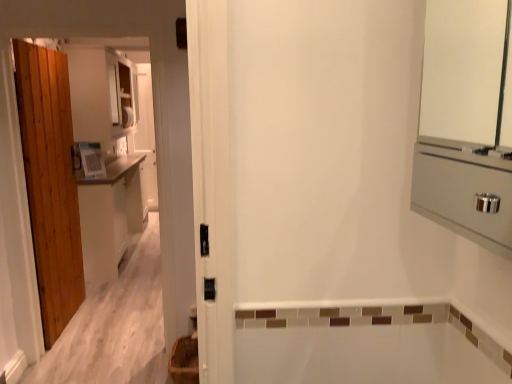
Locate an element on the screen. This screenshot has width=512, height=384. white matte cabinet at left is located at coordinates (111, 215).

In order to face white matte cabinet at left, should I rotate leftwards or rightwards?

Turn left approximately 18.091 degrees to face it.

Describe the element at coordinates (111, 215) in the screenshot. I see `white matte cabinet at left` at that location.

This screenshot has height=384, width=512. Describe the element at coordinates (184, 361) in the screenshot. I see `brown woven basket at lower left` at that location.

This screenshot has width=512, height=384. In order to click on brown woven basket at lower left in this screenshot , I will do `click(184, 361)`.

This screenshot has height=384, width=512. Identify the location of white matte cabinet at left. (111, 215).

Can you confirm if white matte cabinet at left is positioned to the right of brown woven basket at lower left?

No.

Between white matte cabinet at left and brown woven basket at lower left, which one is positioned in front?

brown woven basket at lower left.

Is point (86, 255) closer or farther from the camera than point (182, 340)?

Point (86, 255) is positioned farther from the camera compared to point (182, 340).

From the image's perspective, does white matte cabinet at left appear lower than brown woven basket at lower left?

No, from the image's perspective, white matte cabinet at left is not beneath brown woven basket at lower left.

From a real-world perspective, is white matte cabinet at left physically located above or below brown woven basket at lower left?

In terms of real-world spatial position, white matte cabinet at left is above brown woven basket at lower left.

Between white matte cabinet at left and brown woven basket at lower left, which one has larger width?

Wider between the two is brown woven basket at lower left.

Considering the relative sizes of white matte cabinet at left and brown woven basket at lower left in the image provided, is white matte cabinet at left taller than brown woven basket at lower left?

Indeed, white matte cabinet at left has a greater height compared to brown woven basket at lower left.

Can you confirm if white matte cabinet at left is smaller than brown woven basket at lower left?

No.

Can we say white matte cabinet at left lies outside brown woven basket at lower left?

Yes, white matte cabinet at left is not within brown woven basket at lower left.

Is white matte cabinet at left placed right next to brown woven basket at lower left?

No, white matte cabinet at left is not with brown woven basket at lower left.

Could you tell me if white matte cabinet at left is turned towards brown woven basket at lower left?

No, white matte cabinet at left does not turn towards brown woven basket at lower left.

You are a GUI agent. You are given a task and a screenshot of the screen. Output one action in this format:
    pyautogui.click(x=<x>, y=<y>)
    Task: Click on the cabinetry above the brown woven basket at lower left (from the image's perspective)
    
    Given the screenshot: What is the action you would take?
    pyautogui.click(x=111, y=215)

Does brown woven basket at lower left appear on the left side of white matte cabinet at left?

No, brown woven basket at lower left is not to the left of white matte cabinet at left.

Is brown woven basket at lower left in front of or behind white matte cabinet at left in the image?

Clearly, brown woven basket at lower left is in front of white matte cabinet at left.

Does point (196, 362) appear closer or farther from the camera than point (110, 251)?

Point (196, 362) is closer to the camera than point (110, 251).

From the image's perspective, is brown woven basket at lower left below white matte cabinet at left?

Yes, from the image's perspective, brown woven basket at lower left is beneath white matte cabinet at left.

From a real-world perspective, relative to white matte cabinet at left, is brown woven basket at lower left vertically above or below?

From a real-world perspective, brown woven basket at lower left is physically below white matte cabinet at left.

Is brown woven basket at lower left wider or thinner than white matte cabinet at left?

Clearly, brown woven basket at lower left has more width compared to white matte cabinet at left.

Can you confirm if brown woven basket at lower left is shorter than white matte cabinet at left?

Yes, brown woven basket at lower left is shorter than white matte cabinet at left.

In terms of size, does brown woven basket at lower left appear bigger or smaller than white matte cabinet at left?

Clearly, brown woven basket at lower left is smaller in size than white matte cabinet at left.

Do you think brown woven basket at lower left is within white matte cabinet at left, or outside of it?

brown woven basket at lower left is not enclosed by white matte cabinet at left.

Is brown woven basket at lower left not close to white matte cabinet at left?

Absolutely, brown woven basket at lower left is distant from white matte cabinet at left.

Does brown woven basket at lower left turn towards white matte cabinet at left?

No.

Identify the location of cabinetry located above the brown woven basket at lower left (from the image's perspective). (111, 215).

Image resolution: width=512 pixels, height=384 pixels. In order to click on cabinetry on the left of brown woven basket at lower left in this screenshot , I will do `click(111, 215)`.

Identify the location of cabinetry above the brown woven basket at lower left (from the image's perspective). The width and height of the screenshot is (512, 384). (111, 215).